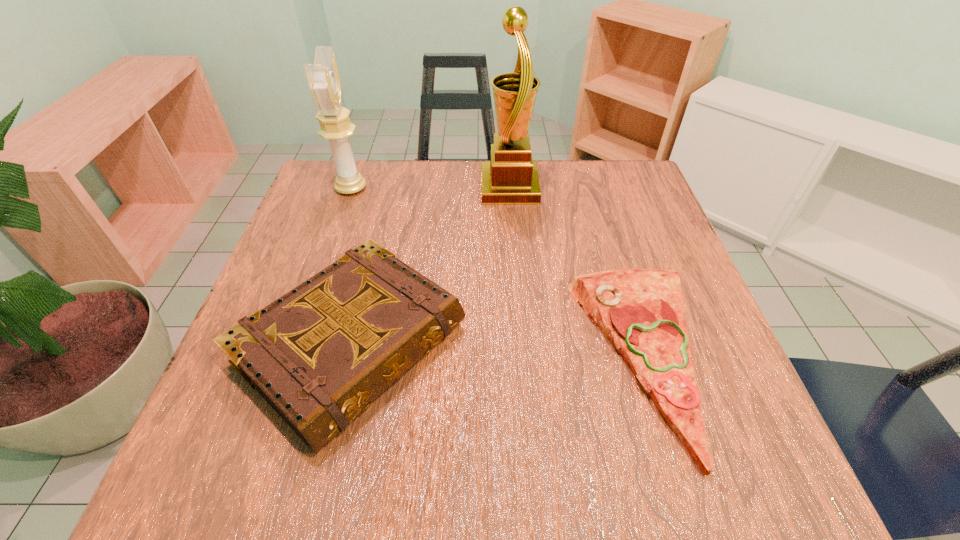
Locate an element on the screen. The image size is (960, 540). object that is positioned at the near right corner is located at coordinates (641, 311).

Find the location of a particular element. The width and height of the screenshot is (960, 540). vacant area at the far edge is located at coordinates (407, 200).

The height and width of the screenshot is (540, 960). What are the coordinates of `vacant space at the near edge of the desktop` in the screenshot? It's located at (660, 476).

You are a GUI agent. You are given a task and a screenshot of the screen. Output one action in this format:
    pyautogui.click(x=<x>, y=<y>)
    Task: Click on the free space at the left edge of the desktop
    
    Given the screenshot: What is the action you would take?
    pyautogui.click(x=313, y=248)

You are a GUI agent. You are given a task and a screenshot of the screen. Output one action in this format:
    pyautogui.click(x=<x>, y=<y>)
    Task: Click on the vacant position at the right edge of the desktop
    This screenshot has width=960, height=540.
    Given the screenshot: What is the action you would take?
    pyautogui.click(x=697, y=293)

Locate an element on the screen. The image size is (960, 540). free space at the far left corner of the desktop is located at coordinates (317, 173).

Locate an element on the screen. free spot at the near left corner of the desktop is located at coordinates (272, 459).

I want to click on free region at the far right corner of the desktop, so click(x=603, y=177).

At what (x,y) coordinates should I click in order to perform the action: click on vacant region at the near right corner of the desktop. Please return your answer as a coordinate pair (x, y). The height and width of the screenshot is (540, 960). Looking at the image, I should click on (712, 475).

Find the location of a particular element. The width and height of the screenshot is (960, 540). unoccupied position between the pizza and the third object from left to right is located at coordinates pos(576,273).